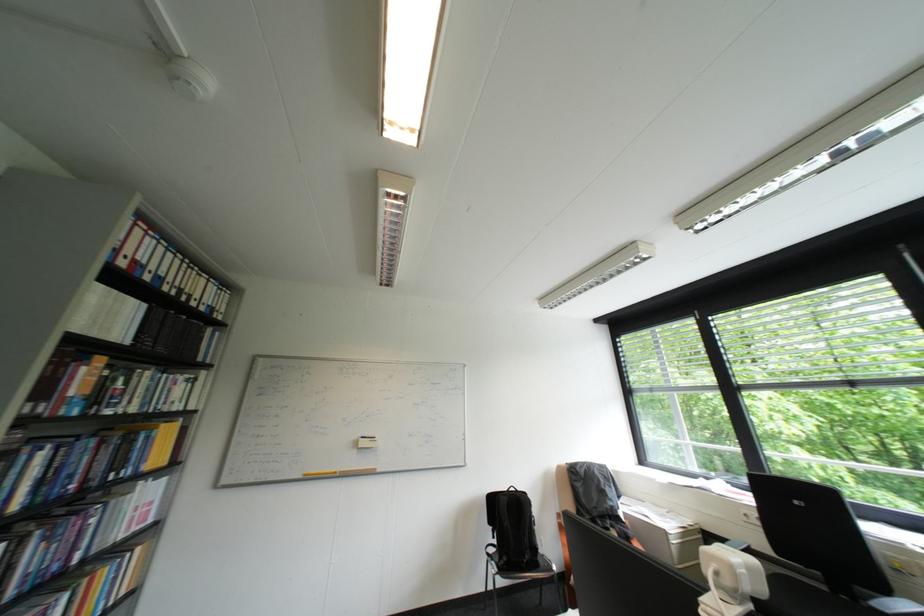
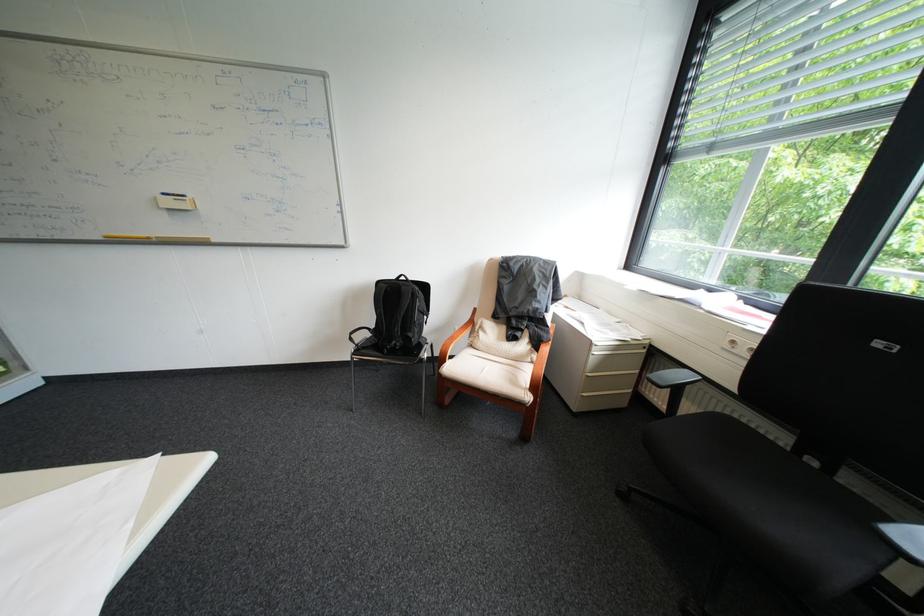
The point at (686, 543) is marked in the first image. Where is the corresponding point in the second image?

(609, 353)